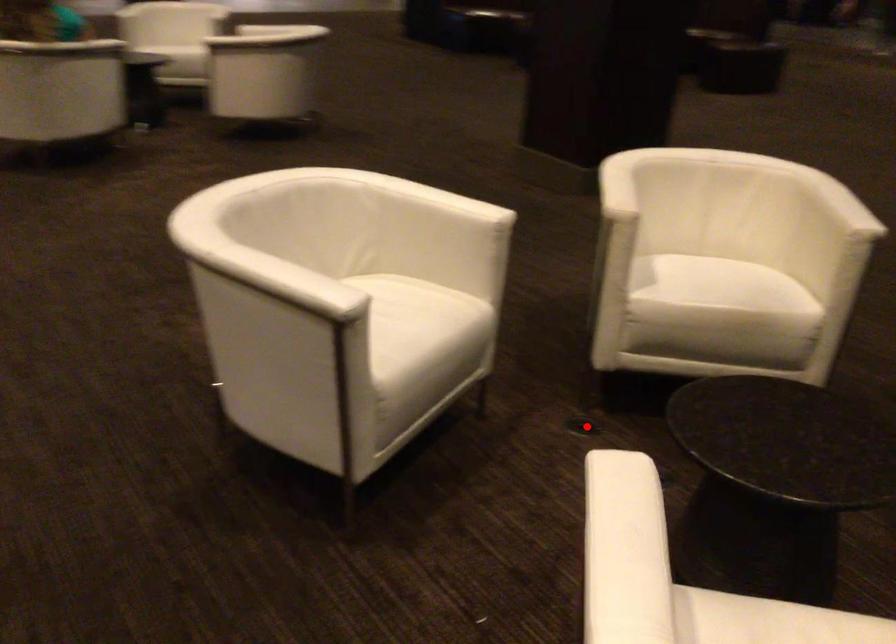
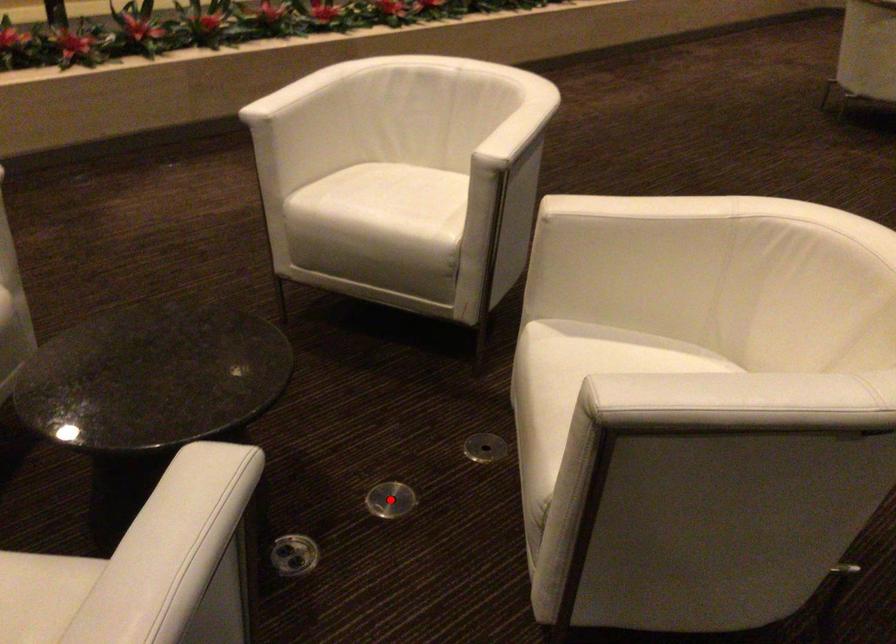
I am providing you with two images of the same scene from different viewpoints. A red point is marked on the first image and another point is marked on the second image. Are the points marked in image1 and image2 representing the same 3D position?

No